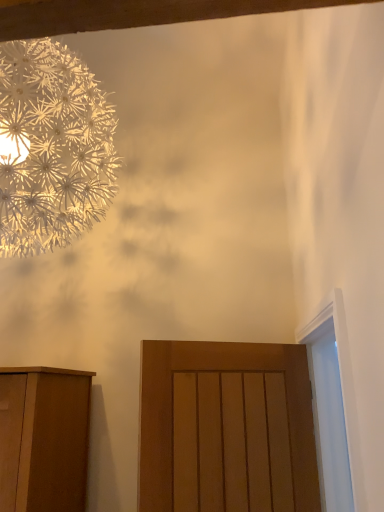
Question: Can you confirm if metallic silver flower at upper left is thinner than white glossy door at right?

Choices:
 (A) no
 (B) yes

Answer: (A)

Question: From a real-world perspective, is metallic silver flower at upper left under white glossy door at right?

Choices:
 (A) no
 (B) yes

Answer: (A)

Question: Is metallic silver flower at upper left taller than white glossy door at right?

Choices:
 (A) yes
 (B) no

Answer: (A)

Question: From a real-world perspective, is metallic silver flower at upper left positioned over white glossy door at right based on gravity?

Choices:
 (A) yes
 (B) no

Answer: (A)

Question: Can you confirm if metallic silver flower at upper left is positioned to the left of white glossy door at right?

Choices:
 (A) yes
 (B) no

Answer: (A)

Question: Does metallic silver flower at upper left turn towards white glossy door at right?

Choices:
 (A) no
 (B) yes

Answer: (A)

Question: Can you confirm if white glossy door at right is taller than matte wood door at center?

Choices:
 (A) yes
 (B) no

Answer: (A)

Question: Does white glossy door at right have a smaller size compared to matte wood door at center?

Choices:
 (A) no
 (B) yes

Answer: (A)

Question: Does white glossy door at right come in front of matte wood door at center?

Choices:
 (A) yes
 (B) no

Answer: (A)

Question: From the image's perspective, is white glossy door at right located beneath matte wood door at center?

Choices:
 (A) yes
 (B) no

Answer: (B)

Question: Is the position of white glossy door at right more distant than that of matte wood door at center?

Choices:
 (A) yes
 (B) no

Answer: (B)

Question: Considering the relative sizes of white glossy door at right and matte wood door at center in the image provided, is white glossy door at right wider than matte wood door at center?

Choices:
 (A) yes
 (B) no

Answer: (A)

Question: Can matte wood door at center be found inside metallic silver flower at upper left?

Choices:
 (A) yes
 (B) no

Answer: (B)